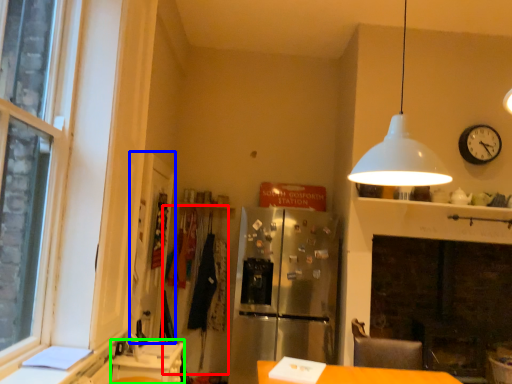
Question: Which is nearer to the laundry (highlighted by a red box)? glass door (highlighted by a blue box) or counter (highlighted by a green box).

Choices:
 (A) glass door
 (B) counter

Answer: (A)